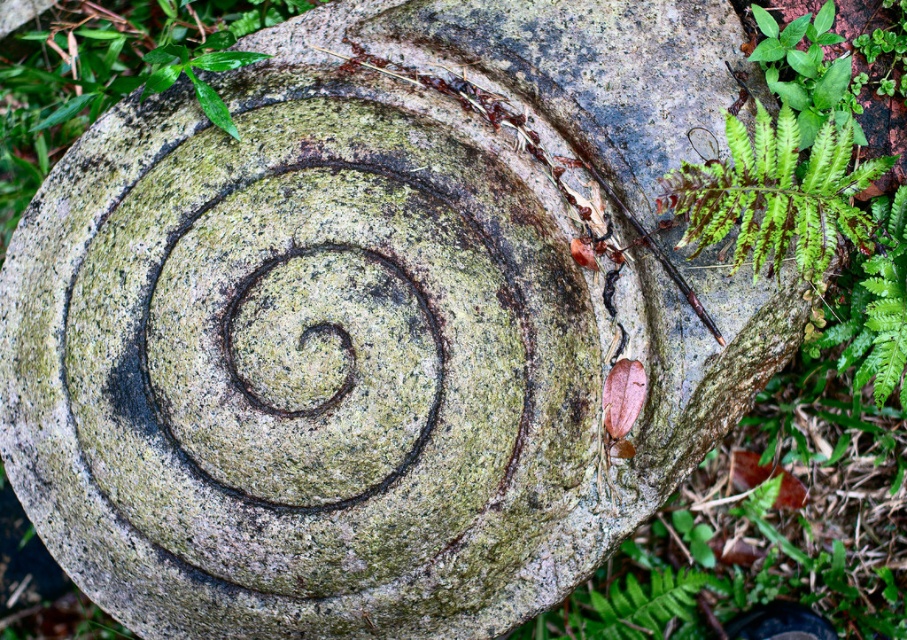
Question: Does green leafy plant at center appear over green leafy fern at upper right?

Choices:
 (A) yes
 (B) no

Answer: (A)

Question: Which point is farther to the camera?

Choices:
 (A) pyautogui.click(x=85, y=0)
 (B) pyautogui.click(x=777, y=152)

Answer: (A)

Question: Which of the following is the farthest from the observer?

Choices:
 (A) pos(791,192)
 (B) pos(223,32)

Answer: (B)

Question: Can you confirm if green leafy plant at center is wider than green leafy fern at upper right?

Choices:
 (A) no
 (B) yes

Answer: (B)

Question: Can you confirm if green leafy plant at center is positioned to the left of green leafy fern at upper right?

Choices:
 (A) yes
 (B) no

Answer: (A)